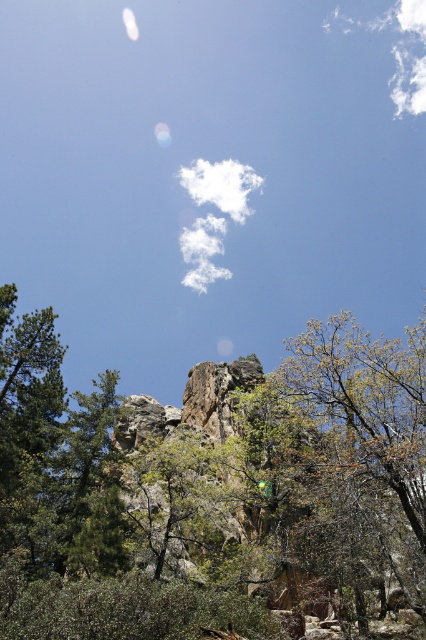
Question: Can you confirm if green matte tree at left is thinner than white fluffy cloud at upper center?

Choices:
 (A) no
 (B) yes

Answer: (B)

Question: Considering the real-world distances, which object is closest to the green matte tree at left?

Choices:
 (A) white fluffy cloud at upper right
 (B) white fluffy cloud at upper center

Answer: (B)

Question: Which of the following is the closest to the observer?

Choices:
 (A) green matte tree at left
 (B) white fluffy cloud at upper center
 (C) white fluffy cloud at upper right

Answer: (A)

Question: Can you confirm if green matte tree at left is bigger than white fluffy cloud at upper right?

Choices:
 (A) yes
 (B) no

Answer: (B)

Question: In this image, where is green matte tree at left located relative to white fluffy cloud at upper right?

Choices:
 (A) left
 (B) right

Answer: (A)

Question: Estimate the real-world distances between objects in this image. Which object is farther from the white fluffy cloud at upper right?

Choices:
 (A) green matte tree at left
 (B) white fluffy cloud at upper center

Answer: (A)